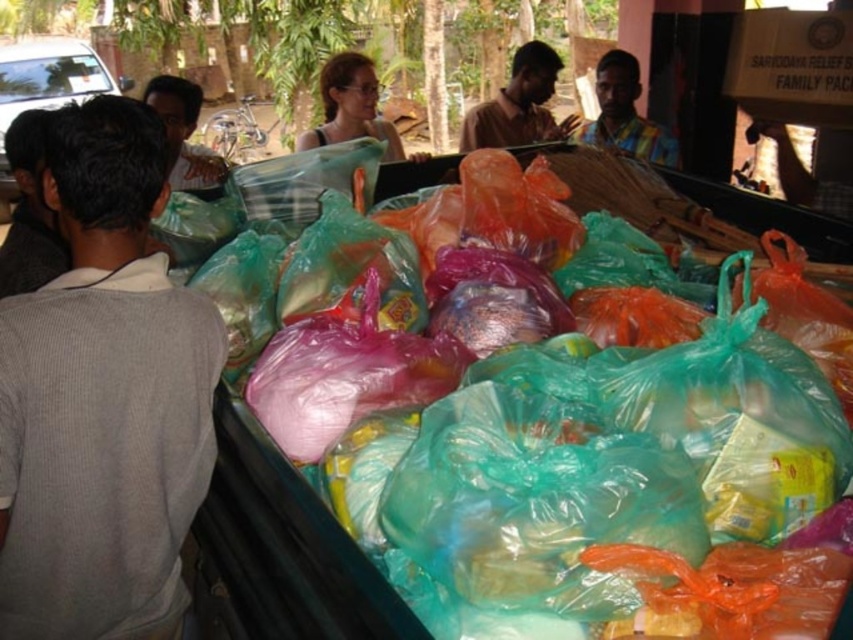
You are standing at point (619, 54) and want to walk to point (648, 230). Is the path between these two points clear?

Yes, the path between point (619, 54) and point (648, 230) is clear because point (648, 230) is in front of point (619, 54), indicating no obstruction between them.

You are organizing a relief distribution event and need to ensure that volunteers are properly spaced. You see a gray cotton shirt at left and a multicolored fabric shirt at center. Which volunteer is standing more to the left?

The gray cotton shirt at left is more to the left than the multicolored fabric shirt at center because the gray cotton shirt at left is positioned on the left side of multicolored fabric shirt at center.

You are organizing a relief distribution and need to decide which volunteer to assign to carry heavier items. Based on their clothing, which volunteer, the one wearing the gray cotton shirt at left or the multicolored fabric shirt at center, might be more suitable for the task?

The gray cotton shirt at left is thinner than the multicolored fabric shirt at center, so the volunteer wearing the multicolored fabric shirt at center might be more suitable for carrying heavier items as they appear to have a stronger build.